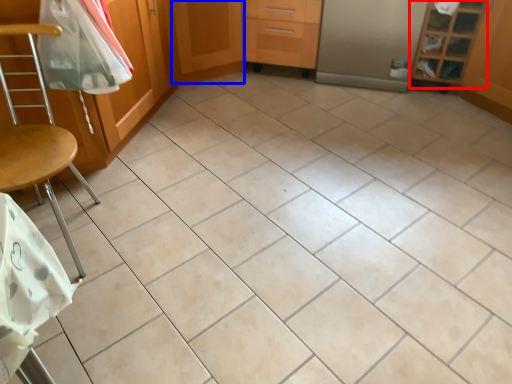
Question: Which object is closer to the camera taking this photo, shelf (highlighted by a red box) or screen door (highlighted by a blue box)?

Choices:
 (A) shelf
 (B) screen door

Answer: (A)